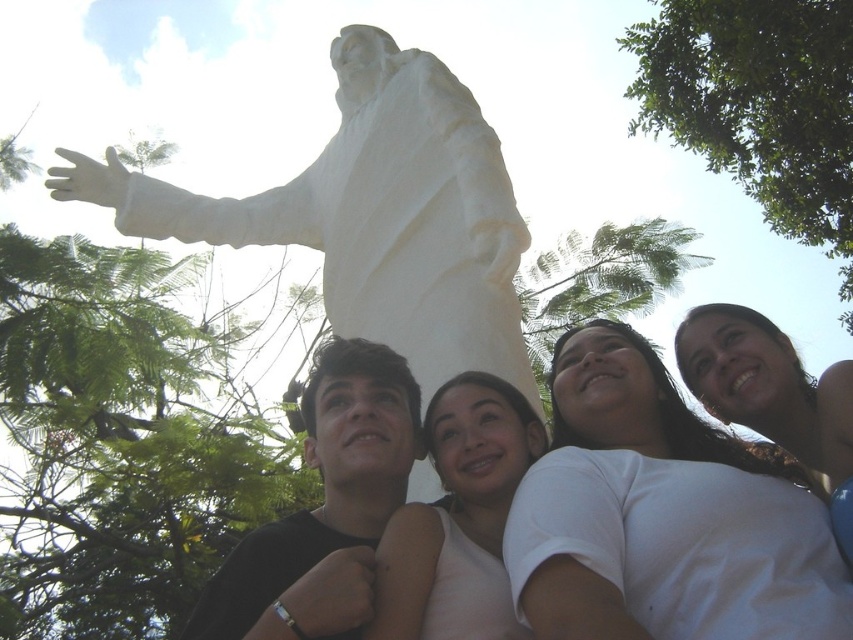
Measure the distance between point (637, 365) and camera.

They are 48.55 meters apart.

Can you confirm if white t-shirt at lower right is wider than smooth white statue at center?

Correct, the width of white t-shirt at lower right exceeds that of smooth white statue at center.

Which is behind, point (769, 518) or point (496, 429)?

Point (496, 429)

The height and width of the screenshot is (640, 853). I want to click on white t-shirt at lower right, so click(x=663, y=515).

Describe the element at coordinates (373, 214) in the screenshot. This screenshot has width=853, height=640. I see `white marble statue at upper center` at that location.

Can you confirm if white marble statue at upper center is positioned below black matte shirt at lower left?

No, white marble statue at upper center is not below black matte shirt at lower left.

What do you see at coordinates (373, 214) in the screenshot? I see `white marble statue at upper center` at bounding box center [373, 214].

Identify the location of white marble statue at upper center. (373, 214).

Between smooth white statue at center and matte white statue at upper center, which one appears on the right side from the viewer's perspective?

matte white statue at upper center

Is smooth white statue at center smaller than matte white statue at upper center?

Yes.

Who is more distant from viewer, (430, 420) or (773, 333)?

Positioned behind is point (773, 333).

Identify the location of smooth white statue at center. (457, 518).